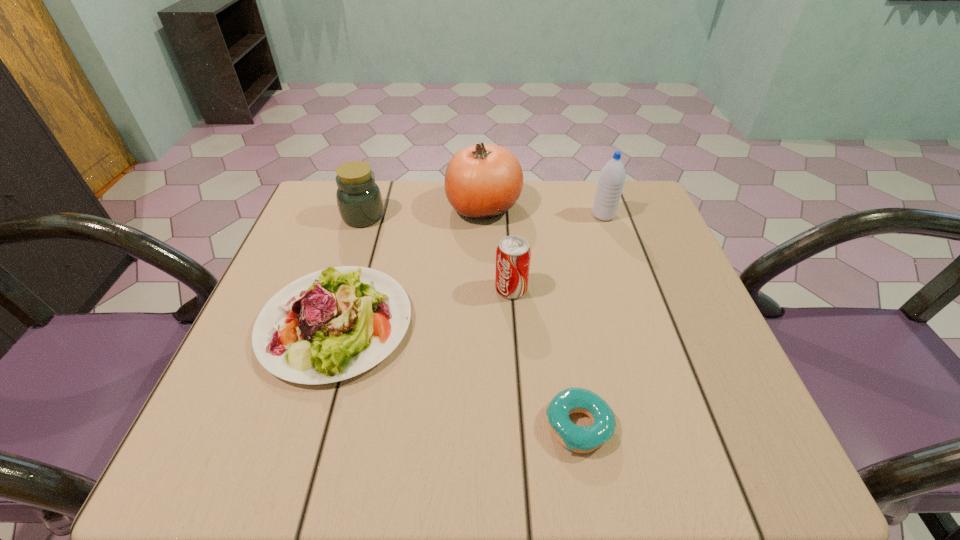
Locate an element on the screen. blank space located on the left of the soda can is located at coordinates (408, 289).

Locate an element on the screen. This screenshot has width=960, height=540. vacant space located on the right of the salad plate is located at coordinates (520, 324).

This screenshot has height=540, width=960. I want to click on free space located on the left of the nearest object, so click(x=509, y=426).

At what (x,y) coordinates should I click in order to perform the action: click on pumpkin that is positioned at the far edge. Please return your answer as a coordinate pair (x, y). This screenshot has width=960, height=540. Looking at the image, I should click on (482, 181).

The width and height of the screenshot is (960, 540). In order to click on water bottle located in the far edge section of the desktop in this screenshot , I will do `click(611, 180)`.

The height and width of the screenshot is (540, 960). What are the coordinates of `jar that is positioned at the far edge` in the screenshot? It's located at (359, 200).

Find the location of a particular element. Image resolution: width=960 pixels, height=540 pixels. object positioned at the near edge is located at coordinates (580, 439).

Locate an element on the screen. This screenshot has height=540, width=960. jar that is at the left edge is located at coordinates (359, 200).

Locate an element on the screen. salad plate at the left edge is located at coordinates (333, 324).

Where is `object that is at the right edge`? object that is at the right edge is located at coordinates (611, 180).